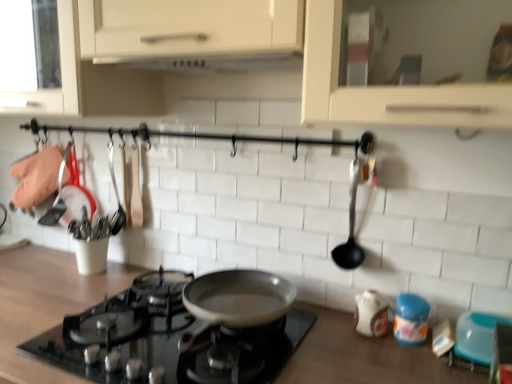
Describe the element at coordinates (211, 62) in the screenshot. The image size is (512, 384). I see `white matte exhaust hood at upper center` at that location.

The image size is (512, 384). What do you see at coordinates (166, 339) in the screenshot?
I see `black glass gas stove at center` at bounding box center [166, 339].

Image resolution: width=512 pixels, height=384 pixels. What are the coordinates of `blue plastic bowl at lower right, which appears as the 1th appliance when viewed from the right` in the screenshot? It's located at (477, 336).

Describe the element at coordinates (477, 336) in the screenshot. I see `blue plastic bowl at lower right, the second appliance from the left` at that location.

Locate an element on the screen. The width and height of the screenshot is (512, 384). white matte exhaust hood at upper center is located at coordinates (211, 62).

Can you confirm if blue plastic container at lower right, marked as the second appliance in a right-to-left arrangement, is shorter than wooden countertop at center?

Yes.

From the image's perspective, which one is positioned higher, blue plastic container at lower right, placed as the first appliance when sorted from left to right, or wooden countertop at center?

blue plastic container at lower right, placed as the first appliance when sorted from left to right, from the image's perspective.

Does blue plastic container at lower right, marked as the second appliance in a right-to-left arrangement, contain wooden countertop at center?

No, wooden countertop at center is not surrounded by blue plastic container at lower right, marked as the second appliance in a right-to-left arrangement.

Considering the positions of objects blue plastic container at lower right, placed as the first appliance when sorted from left to right, and wooden countertop at center in the image provided, who is behind, blue plastic container at lower right, placed as the first appliance when sorted from left to right, or wooden countertop at center?

blue plastic container at lower right, placed as the first appliance when sorted from left to right, is further from the camera.

Is wooden countertop at center turned away from blue plastic bowl at lower right, the second appliance from the left?

wooden countertop at center is not turned away from blue plastic bowl at lower right, the second appliance from the left.

Is wooden countertop at center at the left side of blue plastic bowl at lower right, which appears as the 1th appliance when viewed from the right?

Correct, you'll find wooden countertop at center to the left of blue plastic bowl at lower right, which appears as the 1th appliance when viewed from the right.

Which object is closer to the camera taking this photo, wooden countertop at center or blue plastic bowl at lower right, the second appliance from the left?

wooden countertop at center is in front.

In the image, there is a blue plastic bowl at lower right, the second appliance from the left. Where is `counter top below it (from a real-world perspective)`? counter top below it (from a real-world perspective) is located at coordinates (46, 301).

Considering the positions of objects white matte exhaust hood at upper center and black glass gas stove at center in the image provided, who is more to the right, white matte exhaust hood at upper center or black glass gas stove at center?

From the viewer's perspective, white matte exhaust hood at upper center appears more on the right side.

Where is `gas stove below the white matte exhaust hood at upper center (from a real-world perspective)`? gas stove below the white matte exhaust hood at upper center (from a real-world perspective) is located at coordinates (166, 339).

In the scene shown: Which is in front, white matte exhaust hood at upper center or black glass gas stove at center?

black glass gas stove at center is closer to the camera.

Could you tell me if white matte exhaust hood at upper center is facing black glass gas stove at center?

No.

Can you confirm if white matte exhaust hood at upper center is positioned to the right of black plastic spoon at right?

No.

Which is in front, point (260, 62) or point (356, 258)?

The point (356, 258) is in front.

Which of these two, white matte exhaust hood at upper center or black plastic spoon at right, is wider?

white matte exhaust hood at upper center.

Is there a large distance between white matte exhaust hood at upper center and black plastic spoon at right?

Actually, white matte exhaust hood at upper center and black plastic spoon at right are a little close together.

Based on their positions, is black glass gas stove at center located to the left or right of wooden countertop at center?

black glass gas stove at center is positioned on wooden countertop at center's right side.

In the image, is black glass gas stove at center positioned in front of or behind wooden countertop at center?

Clearly, black glass gas stove at center is behind wooden countertop at center.

Who is shorter, black glass gas stove at center or wooden countertop at center?

black glass gas stove at center is shorter.

Considering the points (169, 312) and (52, 256), which point is behind, point (169, 312) or point (52, 256)?

The point (52, 256) is behind.

Between blue plastic container at lower right, placed as the first appliance when sorted from left to right, and black glass gas stove at center, which one has smaller size?

blue plastic container at lower right, placed as the first appliance when sorted from left to right.

Relative to black glass gas stove at center, is blue plastic container at lower right, marked as the second appliance in a right-to-left arrangement, in front or behind?

In the image, blue plastic container at lower right, marked as the second appliance in a right-to-left arrangement, appears behind black glass gas stove at center.

Is blue plastic container at lower right, placed as the first appliance when sorted from left to right, next to black glass gas stove at center and touching it?

No, blue plastic container at lower right, placed as the first appliance when sorted from left to right, is not in contact with black glass gas stove at center.

From a real-world perspective, is blue plastic container at lower right, placed as the first appliance when sorted from left to right, positioned above or below black glass gas stove at center?

From a real-world perspective, blue plastic container at lower right, placed as the first appliance when sorted from left to right, is physically above black glass gas stove at center.

Can you tell me how much blue plastic container at lower right, marked as the second appliance in a right-to-left arrangement, and white matte exhaust hood at upper center differ in facing direction?

blue plastic container at lower right, marked as the second appliance in a right-to-left arrangement, and white matte exhaust hood at upper center are facing 0.0941 degrees away from each other.

Is point (405, 309) closer or farther from the camera than point (283, 64)?

Clearly, point (405, 309) is closer to the camera than point (283, 64).

Is blue plastic container at lower right, placed as the first appliance when sorted from left to right, at the left side of white matte exhaust hood at upper center?

No.

I want to click on counter top that is on the left side of blue plastic container at lower right, marked as the second appliance in a right-to-left arrangement, so click(46, 301).

Find the location of a particular element. The width and height of the screenshot is (512, 384). appliance that is the 1st object located above the wooden countertop at center (from the image's perspective) is located at coordinates (477, 336).

Considering their positions, is wooden countertop at center positioned further to black plastic spoon at right than blue plastic bowl at lower right, the second appliance from the left?

Among the two, wooden countertop at center is located further to black plastic spoon at right.

Considering their positions, is blue plastic container at lower right, marked as the second appliance in a right-to-left arrangement, positioned closer to wooden countertop at center than black plastic spoon at right?

black plastic spoon at right is closer to wooden countertop at center.

Estimate the real-world distances between objects in this image. Which object is closer to blue plastic bowl at lower right, the second appliance from the left, black glass gas stove at center or blue plastic container at lower right, placed as the first appliance when sorted from left to right?

blue plastic container at lower right, placed as the first appliance when sorted from left to right.

Based on their spatial positions, is blue plastic bowl at lower right, which appears as the 1th appliance when viewed from the right, or black plastic spoon at right closer to blue plastic container at lower right, placed as the first appliance when sorted from left to right?

Based on the image, blue plastic bowl at lower right, which appears as the 1th appliance when viewed from the right, appears to be nearer to blue plastic container at lower right, placed as the first appliance when sorted from left to right.

Based on their spatial positions, is white matte exhaust hood at upper center or blue plastic container at lower right, placed as the first appliance when sorted from left to right, further from black glass gas stove at center?

white matte exhaust hood at upper center.

Consider the image. Estimate the real-world distances between objects in this image. Which object is further from wooden countertop at center, black plastic spoon at right or black glass gas stove at center?

The object further to wooden countertop at center is black plastic spoon at right.

Considering their positions, is black glass gas stove at center positioned further to black plastic spoon at right than blue plastic bowl at lower right, which appears as the 1th appliance when viewed from the right?

Based on the image, black glass gas stove at center appears to be further to black plastic spoon at right.

From the image, which object appears to be farther from wooden countertop at center, black glass gas stove at center or blue plastic bowl at lower right, which appears as the 1th appliance when viewed from the right?

The object further to wooden countertop at center is blue plastic bowl at lower right, which appears as the 1th appliance when viewed from the right.

This screenshot has width=512, height=384. Find the location of `appliance between white matte exhaust hood at upper center and blue plastic bowl at lower right, which appears as the 1th appliance when viewed from the right, from top to bottom`. appliance between white matte exhaust hood at upper center and blue plastic bowl at lower right, which appears as the 1th appliance when viewed from the right, from top to bottom is located at coordinates (x=411, y=319).

Identify the location of gas stove between wooden countertop at center and blue plastic container at lower right, marked as the second appliance in a right-to-left arrangement, in the horizontal direction. (166, 339).

The image size is (512, 384). In order to click on gas stove between wooden countertop at center and black plastic spoon at right in this screenshot , I will do `click(166, 339)`.

Find the location of a particular element. spoon between white matte exhaust hood at upper center and blue plastic container at lower right, marked as the second appliance in a right-to-left arrangement, vertically is located at coordinates (352, 224).